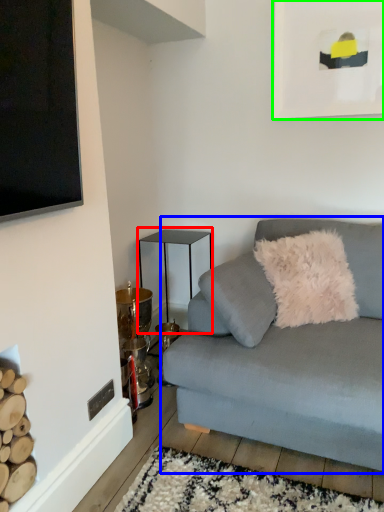
Question: Which is nearer to the table (highlighted by a red box)? studio couch (highlighted by a blue box) or picture frame (highlighted by a green box).

Choices:
 (A) studio couch
 (B) picture frame

Answer: (A)